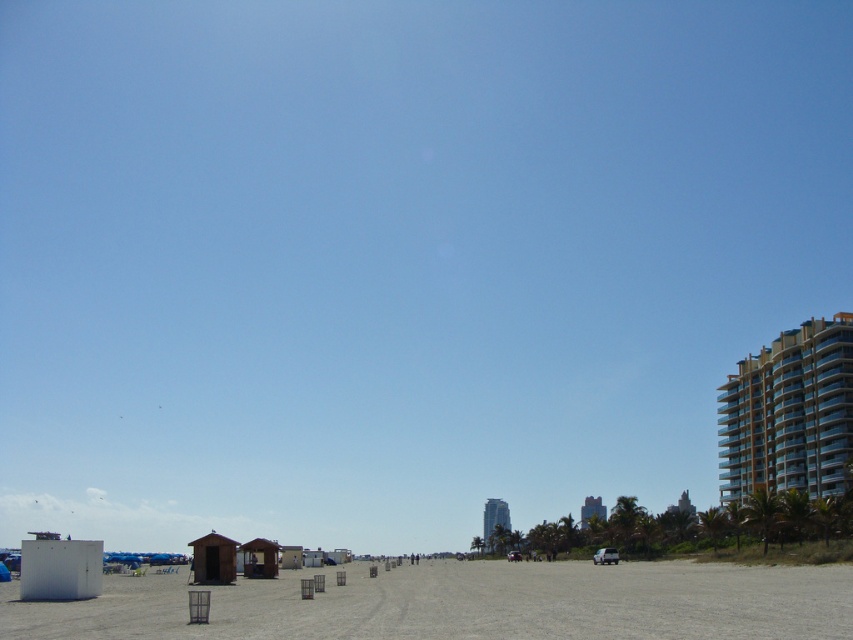
You are a drone operator who needs to fly a drone from the smooth sand beach at center to the metallic gold balcony at right. The drone has a maximum range of 50 meters. Can the drone reach the balcony?

The smooth sand beach at center and metallic gold balcony at right are 54.61 meters apart from each other. Since the drone has a maximum range of 50 meters, it cannot reach the balcony.

You are standing on the smooth sand beach at center and want to walk to the point marked at coordinates (x=465, y=604). Is the point located on the smooth sand beach at center?

The smooth sand beach at center is located at point (x=465, y=604), so yes, the point is located on the smooth sand beach at center.